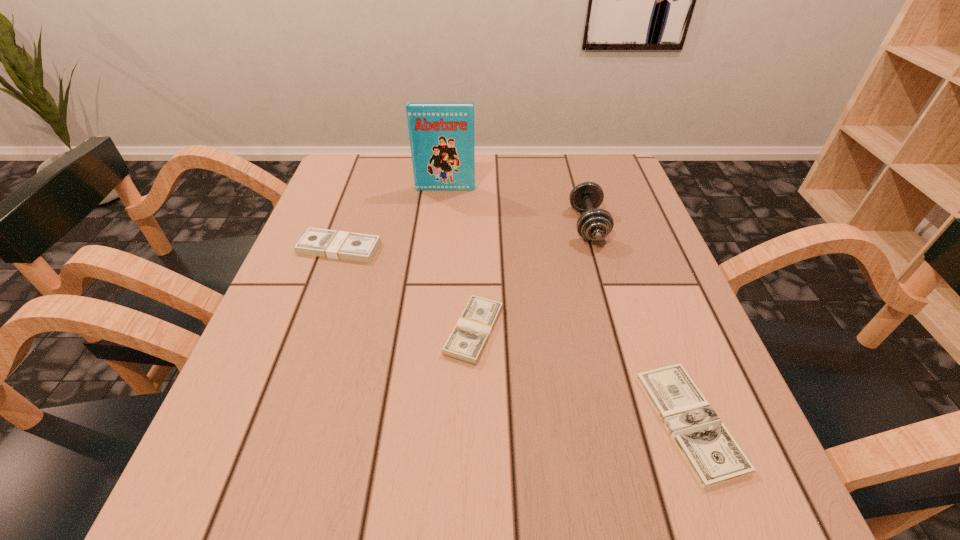
The width and height of the screenshot is (960, 540). What are the coordinates of `vacant area located on the front of the dumbbell` in the screenshot? It's located at (611, 302).

The height and width of the screenshot is (540, 960). What are the coordinates of `free space located 0.100m on the front of the leftmost dollar` in the screenshot? It's located at (322, 298).

Find the location of a particular element. free region located 0.130m on the right of the second shortest dollar is located at coordinates (576, 330).

Find the location of `free space located on the left of the rightmost dollar`. free space located on the left of the rightmost dollar is located at coordinates (391, 422).

Where is `book positioned at the far edge`? book positioned at the far edge is located at coordinates (441, 134).

Locate an element on the screen. The height and width of the screenshot is (540, 960). dumbbell that is at the far edge is located at coordinates (594, 224).

Identify the location of object situated at the near edge. This screenshot has height=540, width=960. (713, 455).

Image resolution: width=960 pixels, height=540 pixels. Find the location of `object that is positioned at the left edge`. object that is positioned at the left edge is located at coordinates (342, 245).

Identify the location of dumbbell located in the right edge section of the desktop. (594, 224).

Locate an element on the screen. The image size is (960, 540). dollar that is at the right edge is located at coordinates (713, 455).